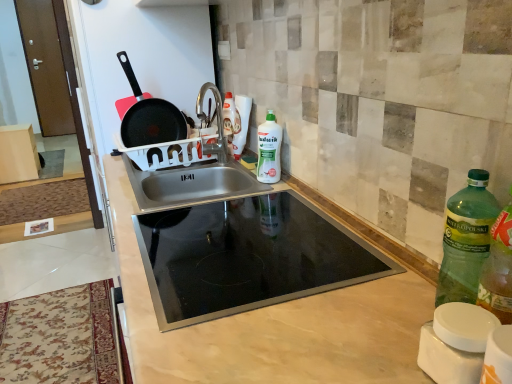
Question: From the image's perspective, is beige marble countertop at center above or below black non-stick frying pan at upper left?

Choices:
 (A) above
 (B) below

Answer: (B)

Question: From a real-world perspective, relative to black non-stick frying pan at upper left, is beige marble countertop at center vertically above or below?

Choices:
 (A) above
 (B) below

Answer: (B)

Question: Which object is the closest to the stainless steel sink at center?

Choices:
 (A) beige marble countertop at center
 (B) green plastic bottle at right, which is counted as the 2th bottle, starting from the back
 (C) green matte bottle at center, positioned as the first bottle in back-to-front order
 (D) black non-stick frying pan at upper left

Answer: (D)

Question: Considering the real-world distances, which object is closest to the stainless steel sink at center?

Choices:
 (A) black non-stick frying pan at upper left
 (B) green matte bottle at center, which is the second bottle from front to back
 (C) green plastic bottle at right, positioned as the first bottle in front-to-back order
 (D) beige marble countertop at center

Answer: (A)